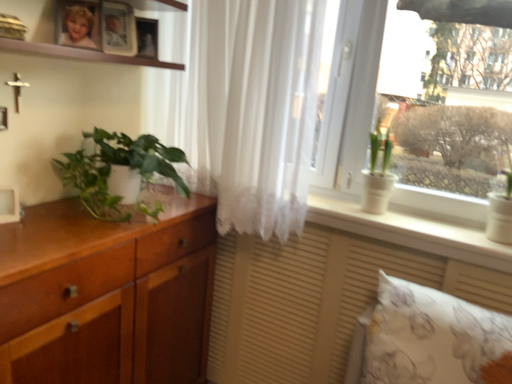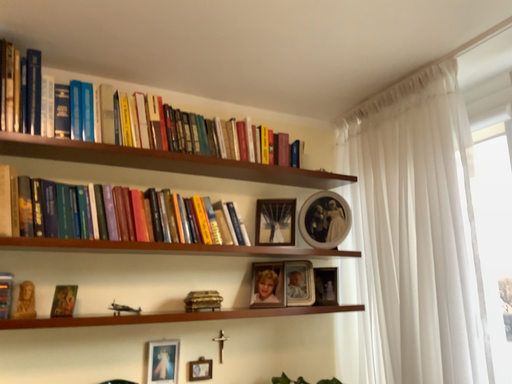
Question: How did the camera likely rotate when shooting the video?

Choices:
 (A) rotated right
 (B) rotated left

Answer: (B)